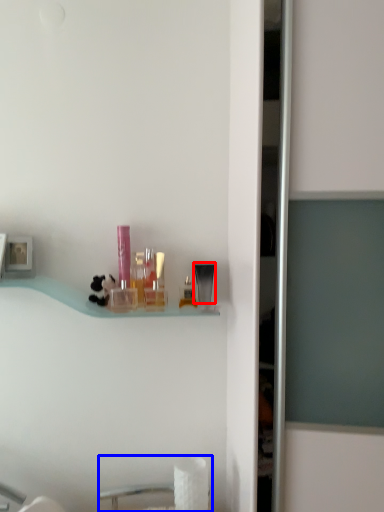
Question: Which point is further to the camera, toiletry (highlighted by a red box) or sink (highlighted by a blue box)?

Choices:
 (A) toiletry
 (B) sink

Answer: (A)